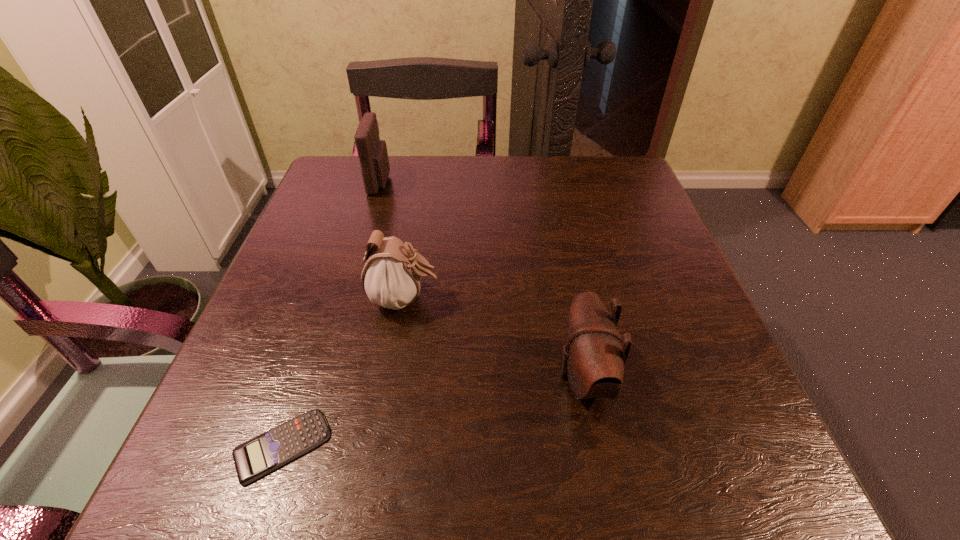
What are the coordinates of `blank space located 0.100m with the flap open on the nearest pouch` in the screenshot? It's located at (493, 376).

Where is `free space located 0.050m with the flap open on the nearest pouch`? The height and width of the screenshot is (540, 960). free space located 0.050m with the flap open on the nearest pouch is located at coordinates (526, 376).

At what (x,y) coordinates should I click in order to perform the action: click on vacant space positioned on the right of the calculator. Please return your answer as a coordinate pair (x, y). The image size is (960, 540). Looking at the image, I should click on (592, 446).

At what (x,y) coordinates should I click in order to perform the action: click on object present at the far edge. Please return your answer as a coordinate pair (x, y). This screenshot has height=540, width=960. Looking at the image, I should click on [x=372, y=152].

In order to click on object situated at the near edge in this screenshot , I will do tap(253, 459).

Identify the location of pouch located in the left edge section of the desktop. (372, 152).

Identify the location of calculator positioned at the left edge. The width and height of the screenshot is (960, 540). (253, 459).

I want to click on object located in the far left corner section of the desktop, so click(x=372, y=152).

Identify the location of object that is at the near left corner. Image resolution: width=960 pixels, height=540 pixels. (253, 459).

The image size is (960, 540). Find the location of `free space at the far edge of the desktop`. free space at the far edge of the desktop is located at coordinates (511, 197).